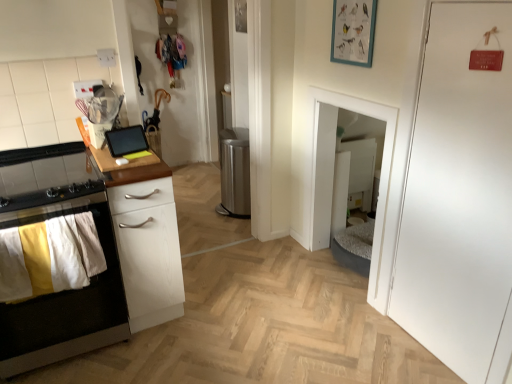
The width and height of the screenshot is (512, 384). In order to click on free point in front of white wood chest of drawers at left in this screenshot , I will do `click(157, 357)`.